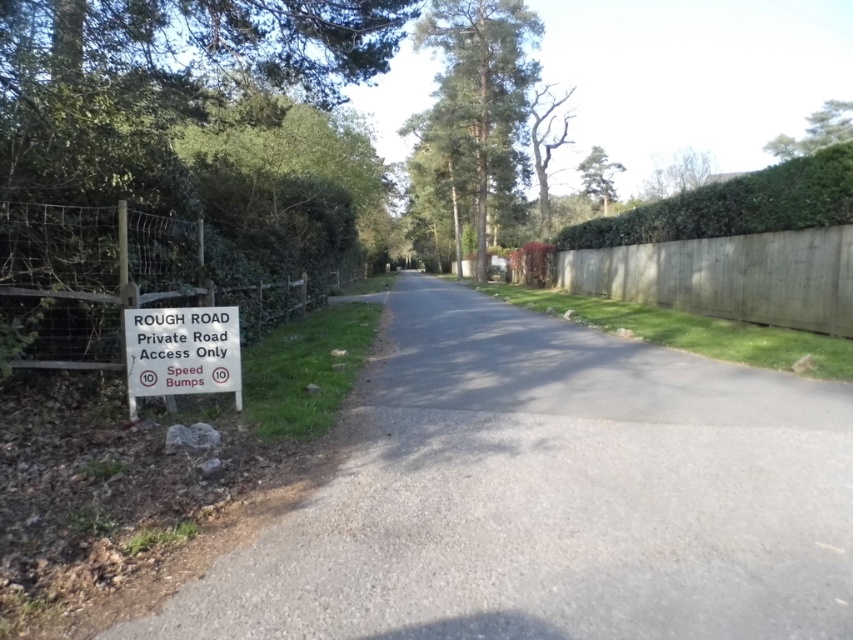
In the scene shown: You are driving a car with a height of 1.6 meters. The car has a clearance of 20 cm. You see the gray asphalt road at left. Is there enough clearance for your car to pass through the area near the point indicated by coordinates (550, 497)?

The point (550, 497) corresponds to the gray asphalt road at left, which is the main road surface. Since the car has a clearance of 20 cm, and the road is flat asphalt, there should be sufficient clearance for the car to pass through that area.

You are a delivery driver approaching the private road with a truck that has a maximum width of 2.5 meters. The road is narrow and has a sign indicating it is a private access road with a speed limit of 10 mph due to bumps. You need to determine if your truck can safely navigate the road. The gray asphalt road at left is located at point (x=550, y=497). Can your truck fit on the road at that point?

The gray asphalt road at left is located at point (x=550, y=497). However, the provided information does not specify the width of the road at that point. Without knowing the road width, it is impossible to determine if the truck with a 2.5 meter width can safely navigate the road at that location.